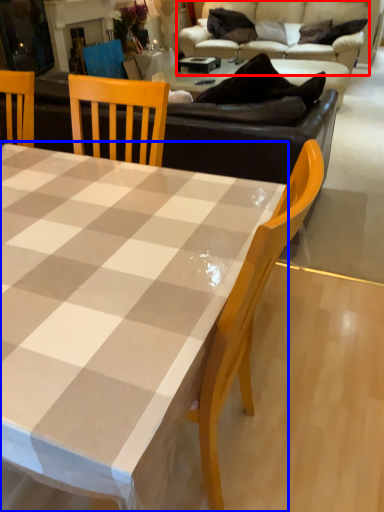
Question: Which point is further to the camera, studio couch (highlighted by a red box) or coffee table (highlighted by a blue box)?

Choices:
 (A) studio couch
 (B) coffee table

Answer: (A)